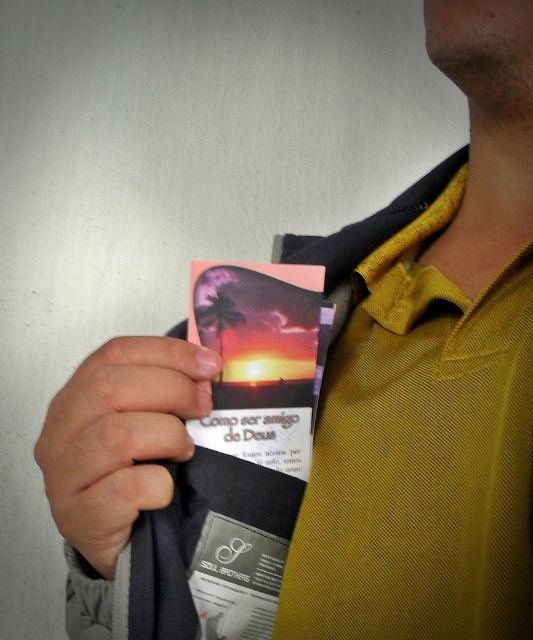
Which of these two, smooth skin hand at lower left or matte plastic card at center, stands shorter?

smooth skin hand at lower left is shorter.

Is point (132, 387) closer to viewer compared to point (293, 308)?

Yes, it is.

Where is `smooth skin hand at lower left`? The width and height of the screenshot is (533, 640). smooth skin hand at lower left is located at coordinates (119, 436).